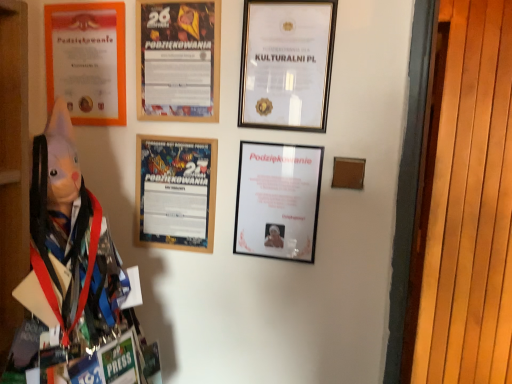
Question: Which is correct: wooden framed poster at center, positioned as the 3th picture frame in right-to-left order, is inside gold-framed certificate at upper center, the fourth picture frame in the left-to-right sequence, or outside of it?

Choices:
 (A) inside
 (B) outside

Answer: (B)

Question: From their relative heights in the image, would you say wooden framed poster at center, which is counted as the 2th picture frame, starting from the left, is taller or shorter than gold-framed certificate at upper center, the fourth picture frame in the left-to-right sequence?

Choices:
 (A) short
 (B) tall

Answer: (A)

Question: Considering the real-world distances, which object is farthest from the wooden framed poster at center, positioned as the 3th picture frame in right-to-left order?

Choices:
 (A) gold-framed certificate at upper center, the fourth picture frame in the left-to-right sequence
 (B) matte orange certificate at upper left, the fourth picture frame in the right-to-left sequence
 (C) matte black picture frame at center, the third picture frame positioned from the left
 (D) matte paper poster at center

Answer: (A)

Question: Estimate the real-world distances between objects in this image. Which object is farther from the matte orange certificate at upper left, the first picture frame from the left?

Choices:
 (A) matte black picture frame at center, the 2th picture frame when ordered from right to left
 (B) gold-framed certificate at upper center, the fourth picture frame in the left-to-right sequence
 (C) matte paper poster at center
 (D) wooden framed poster at center, which is counted as the 2th picture frame, starting from the left

Answer: (A)